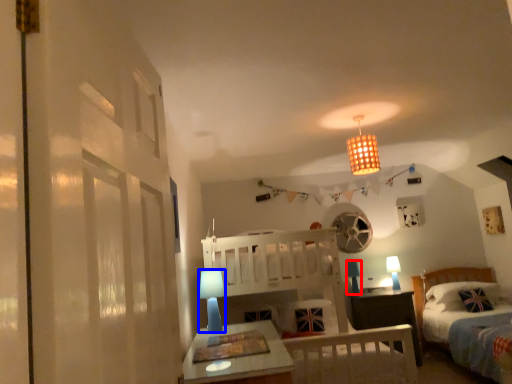
Question: Which object is closer to the camera taking this photo, table lamp (highlighted by a red box) or table lamp (highlighted by a blue box)?

Choices:
 (A) table lamp
 (B) table lamp

Answer: (B)